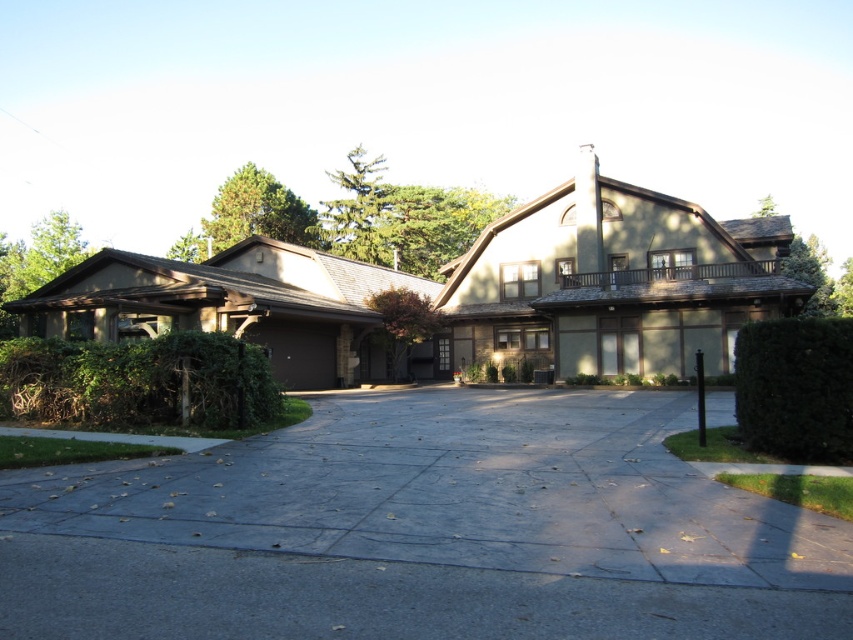
You are a gardener planning to trim both the green leafy hedge at lower left and the green leafy hedge at right. Which hedge requires more time to trim based on their sizes?

The green leafy hedge at lower left requires more time to trim since its width surpasses that of the green leafy hedge at right.

You are standing at the entrance of the house and want to walk to both the point at coordinates (97, 524) and the point at coordinates (753, 337). Which point will you reach first?

You will reach the point at coordinates (97, 524) first because it is closer to you than the point at coordinates (753, 337).

You are a delivery person trying to park your van in the driveway. The van is 2 meters wide. The gray concrete driveway at center and the green leafy hedge at lower left are in your view. Can the van fit into the driveway?

The gray concrete driveway at center is wider than the green leafy hedge at lower left. Since the driveway is wider, the van which is 2 meters wide can fit into the driveway.